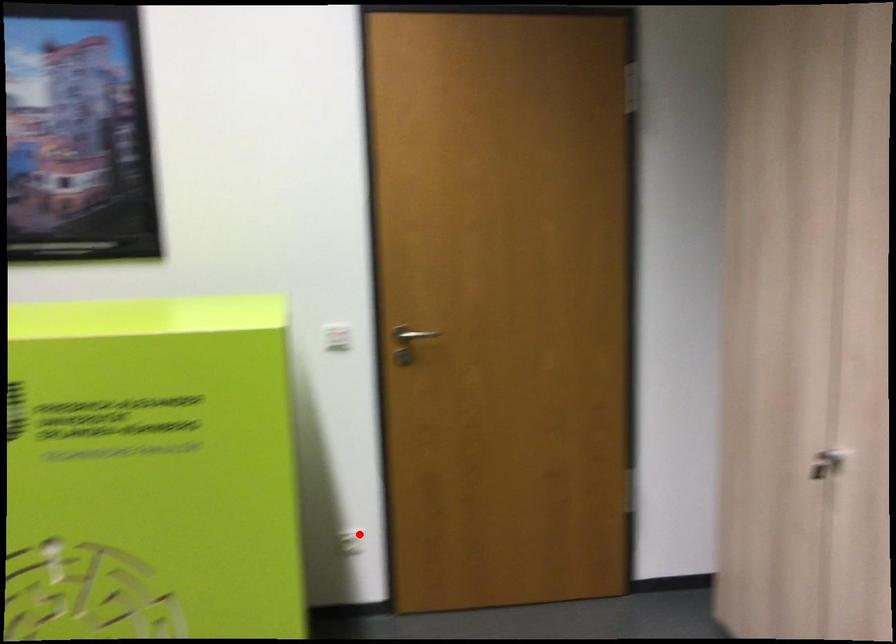
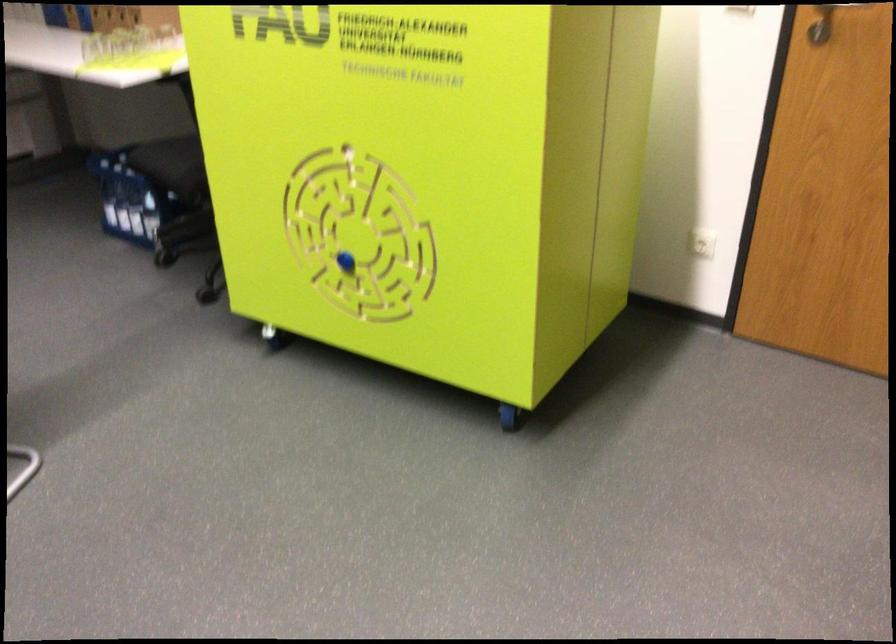
In the second image, find the point that corresponds to the highlighted location in the first image.

(702, 243)